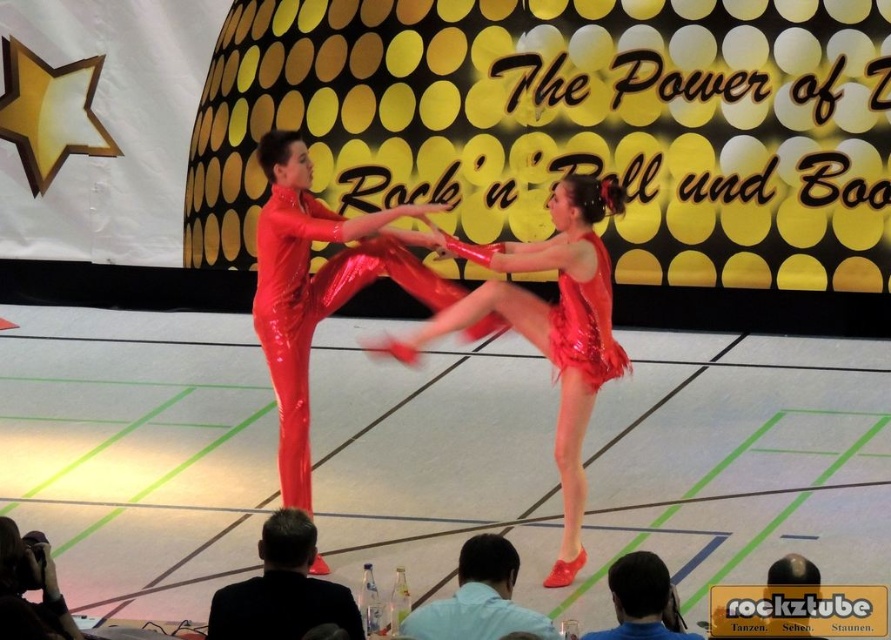
You are a photographer standing at the front of the stage. You notice the shiny red leotard at center and the silvery metallic camera at lower left in your view. Which object is positioned higher in your field of view?

The shiny red leotard at center is located above the silvery metallic camera at lower left, so it is positioned higher in your field of view.

You are a photographer standing at the back of the stage. You want to take a photo that includes both the shiny red dress at center and the black suit at lower center. Which object will appear closer to the camera in the photo?

The shiny red dress at center will appear closer to the camera because it is further to the viewer than the black suit at lower center.